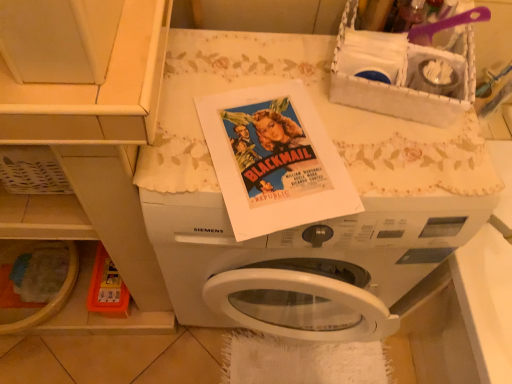
The image size is (512, 384). Identify the location of vacant area that lies in front of white woven basket at upper right. [379, 160].